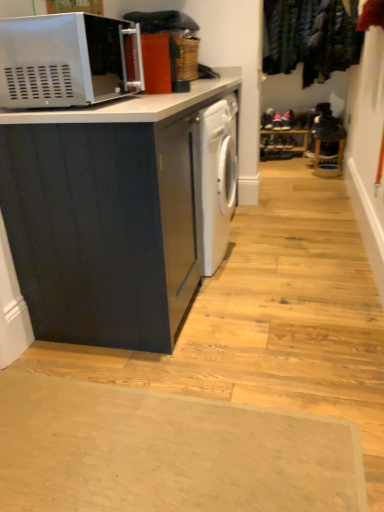
Question: From the image's perspective, would you say matte black cabinet at left is positioned over beige rubber doormat at lower center?

Choices:
 (A) yes
 (B) no

Answer: (A)

Question: Is matte black cabinet at left taller than beige rubber doormat at lower center?

Choices:
 (A) yes
 (B) no

Answer: (A)

Question: Considering the relative sizes of matte black cabinet at left and beige rubber doormat at lower center in the image provided, is matte black cabinet at left thinner than beige rubber doormat at lower center?

Choices:
 (A) no
 (B) yes

Answer: (B)

Question: Can beige rubber doormat at lower center be found inside matte black cabinet at left?

Choices:
 (A) no
 (B) yes

Answer: (A)

Question: From a real-world perspective, is matte black cabinet at left located beneath beige rubber doormat at lower center?

Choices:
 (A) no
 (B) yes

Answer: (A)

Question: Relative to beige rubber doormat at lower center, is matte black cabinet at left in front or behind?

Choices:
 (A) front
 (B) behind

Answer: (B)

Question: Considering the positions of matte black cabinet at left and beige rubber doormat at lower center in the image, is matte black cabinet at left bigger or smaller than beige rubber doormat at lower center?

Choices:
 (A) big
 (B) small

Answer: (A)

Question: Would you say matte black cabinet at left is to the left or to the right of beige rubber doormat at lower center in the picture?

Choices:
 (A) right
 (B) left

Answer: (A)

Question: From the image's perspective, is matte black cabinet at left above or below beige rubber doormat at lower center?

Choices:
 (A) above
 (B) below

Answer: (A)

Question: In the image, is matte black cabinet at left positioned in front of or behind velvet green coat at upper right?

Choices:
 (A) behind
 (B) front

Answer: (B)

Question: From a real-world perspective, is matte black cabinet at left physically located above or below velvet green coat at upper right?

Choices:
 (A) below
 (B) above

Answer: (A)

Question: Is point [130, 190] closer or farther from the camera than point [331, 35]?

Choices:
 (A) farther
 (B) closer

Answer: (B)

Question: In terms of width, does matte black cabinet at left look wider or thinner when compared to velvet green coat at upper right?

Choices:
 (A) wide
 (B) thin

Answer: (A)

Question: Considering their positions, is velvet green coat at upper right located in front of or behind matte black cabinet at left?

Choices:
 (A) behind
 (B) front

Answer: (A)

Question: Is velvet green coat at upper right wider or thinner than matte black cabinet at left?

Choices:
 (A) thin
 (B) wide

Answer: (A)